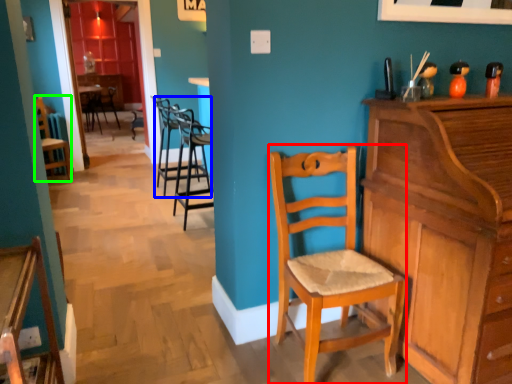
Question: Which is nearer to the chair (highlighted by a red box)? chair (highlighted by a blue box) or chair (highlighted by a green box).

Choices:
 (A) chair
 (B) chair

Answer: (A)